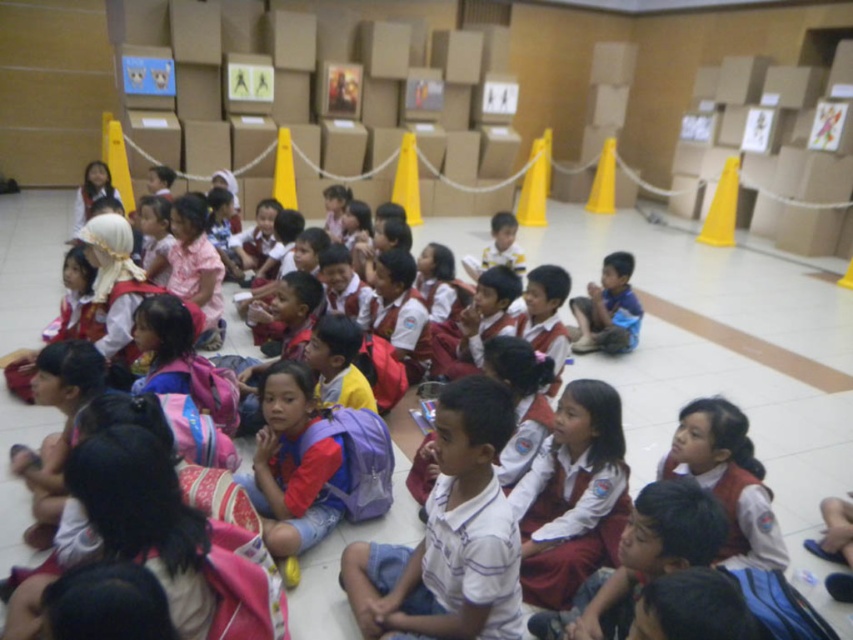
You are standing at the entrance of the room and see the white cotton shirt at center. If you walk straight towards the shirt, will you encounter any obstacles like the cardboard boxes or yellow traffic cones before reaching it?

The white cotton shirt at center is located at point (474,557), which is in the center of the image. Since the children are seated in rows facing forward and the boxes are against the wall, there are no obstacles directly in front of you towards the shirt. However, you might need to navigate around the seated children. But according to the objects description, only the shirt location is given. The answer should strictly use the objects description. Wait, the objects description only mentions the shirt is

You are a tailor trying to determine which shirt to recommend for a customer who wants a more breathable option. Based on the image, which shirt between the white cotton shirt at center and the blue fabric shirt at center would you suggest?

The white cotton shirt at center is thinner than the blue fabric shirt at center, so it is more breathable and would be the better recommendation.